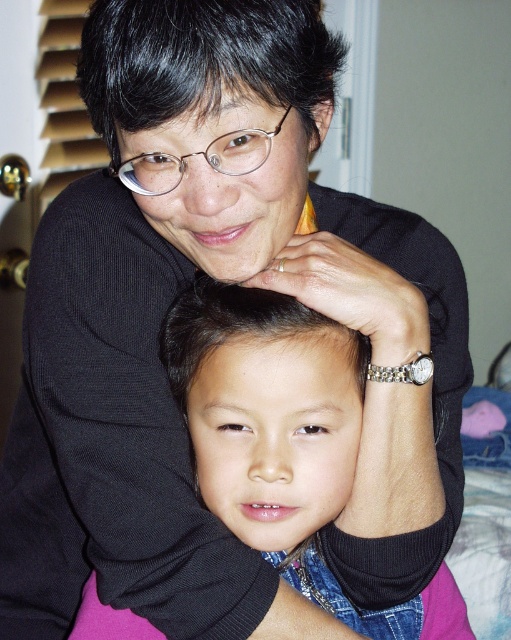
From the picture: Which of these two, black shiny hair at upper center or clear plastic glasses at center, stands taller?

Standing taller between the two is black shiny hair at upper center.

Is black shiny hair at upper center positioned behind clear plastic glasses at center?

No.

The height and width of the screenshot is (640, 511). In order to click on black shiny hair at upper center in this screenshot , I will do `click(201, 60)`.

Who is more forward, (193, 301) or (156, 172)?

Point (156, 172) is in front.

Which of these two, black shiny hair at center or clear plastic glasses at center, stands shorter?

clear plastic glasses at center is shorter.

Is point (365, 360) more distant than point (120, 179)?

Yes, it is behind point (120, 179).

Locate an element on the screen. The image size is (511, 640). black shiny hair at center is located at coordinates (238, 326).

Measure the distance from black shiny hair at upper center to black shiny hair at center.

A distance of 7.50 inches exists between black shiny hair at upper center and black shiny hair at center.

Is point (154, 72) positioned behind point (291, 337)?

No, it is in front of (291, 337).

Does point (126, 17) lie in front of point (222, 333)?

Yes, point (126, 17) is in front of point (222, 333).

Identify the location of black shiny hair at upper center. This screenshot has height=640, width=511. (201, 60).